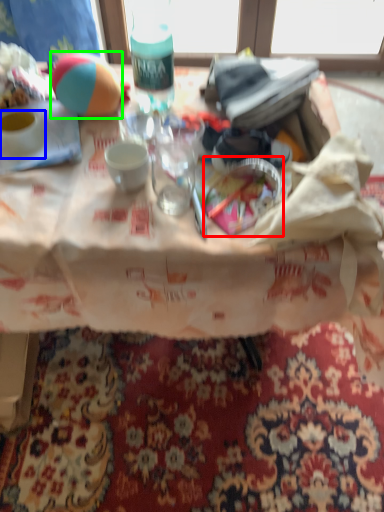
Question: Estimate the real-world distances between objects in this image. Which object is farther from tableware (highlighted by a red box), coffee cup (highlighted by a blue box) or ball (highlighted by a green box)?

Choices:
 (A) coffee cup
 (B) ball

Answer: (A)